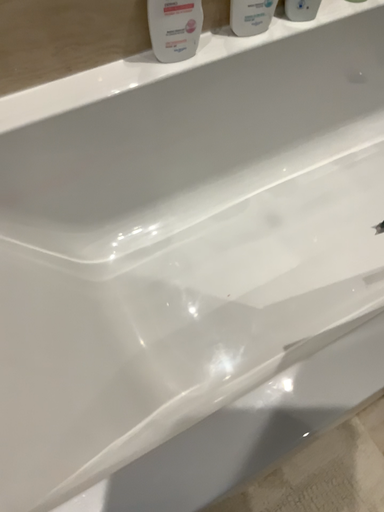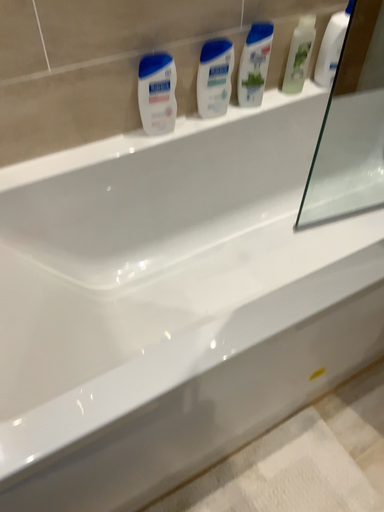
Question: How did the camera likely rotate when shooting the video?

Choices:
 (A) rotated downward
 (B) rotated upward

Answer: (B)